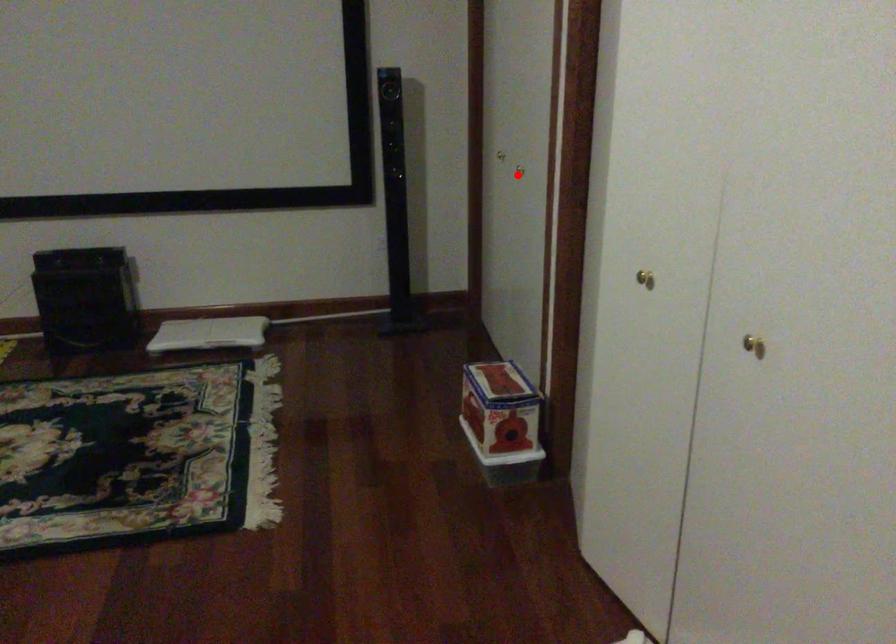
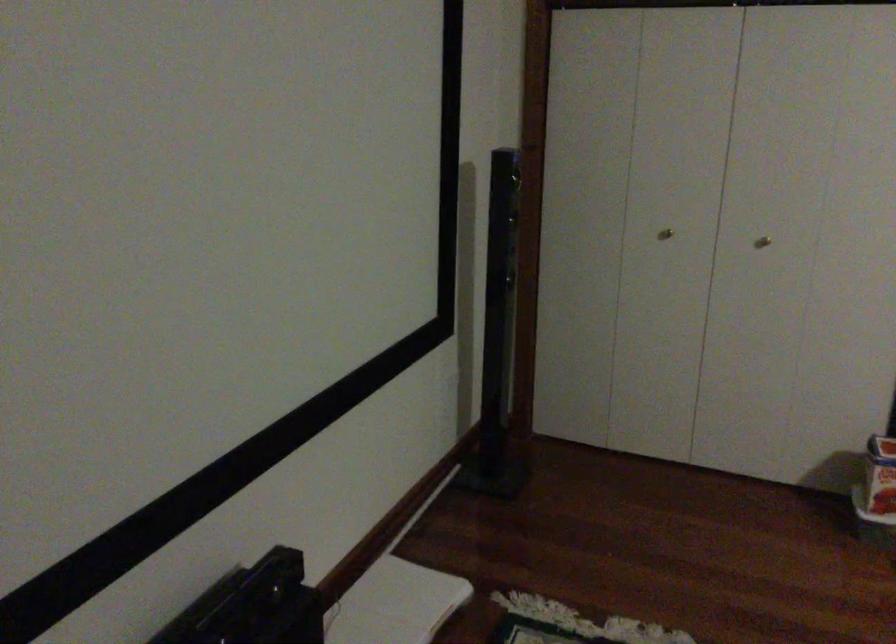
Where in the second image is the point corresponding to the highlighted location from the first image?

(762, 242)